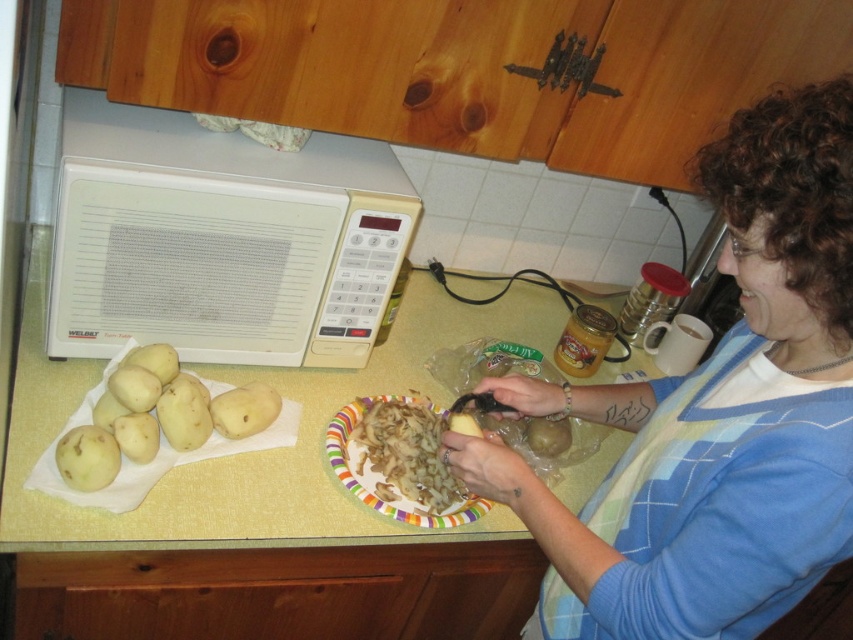
You are standing in the kitchen and want to place a new microwave. The current microwave is at point (219, 240). Where should you place the new microwave so it doesn not overlap with the existing one?

The new microwave should be placed away from the coordinates (219, 240) to avoid overlapping with the existing white plastic microwave at upper left.

You are a chef who needs to place the smooth yellow potato at lower left into the white plastic microwave at upper left. Can you directly put the potato into the microwave without moving anything else?

The white plastic microwave at upper left is above the smooth yellow potato at lower left, so you can directly put the smooth yellow potato at lower left into the white plastic microwave at upper left without moving anything else because the microwave is positioned above the potato.